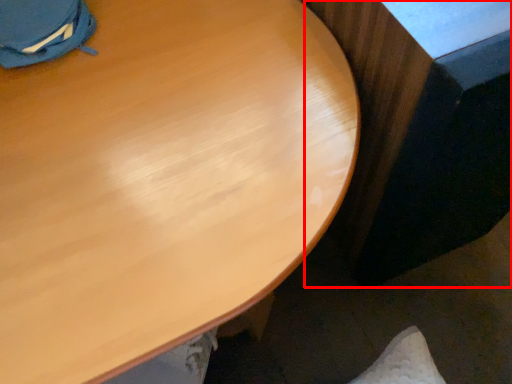
Question: In this image, where is table (annotated by the red box) located relative to desk?

Choices:
 (A) right
 (B) left

Answer: (A)